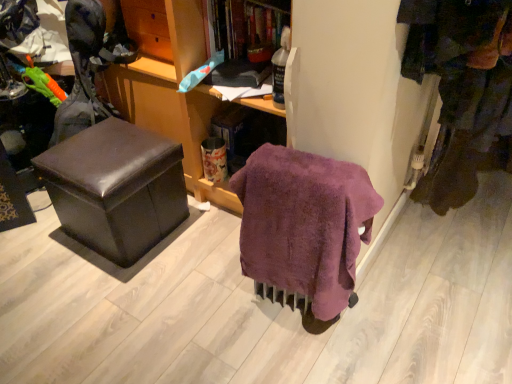
Question: Is dark brown fabric pants at right taller or shorter than wooden shelf at upper center, positioned as the 2th shelf in right-to-left order?

Choices:
 (A) short
 (B) tall

Answer: (B)

Question: Do you think dark brown fabric pants at right is within wooden shelf at upper center, which ranks as the first shelf in left-to-right order, or outside of it?

Choices:
 (A) inside
 (B) outside

Answer: (B)

Question: Based on their relative distances, which object is nearer to the wooden bookshelf at upper center, positioned as the 2th shelf in left-to-right order?

Choices:
 (A) wooden cabinet at center
 (B) dark brown fabric pants at right
 (C) wooden shelf at upper center, positioned as the 2th shelf in right-to-left order
 (D) purple fluffy blanket at center
 (E) shiny brown ottoman at left

Answer: (C)

Question: Which is nearer to the dark brown fabric pants at right?

Choices:
 (A) wooden cabinet at center
 (B) shiny brown ottoman at left
 (C) wooden bookshelf at upper center, the 1th shelf when ordered from right to left
 (D) wooden shelf at upper center, positioned as the 2th shelf in right-to-left order
 (E) purple fluffy blanket at center

Answer: (E)